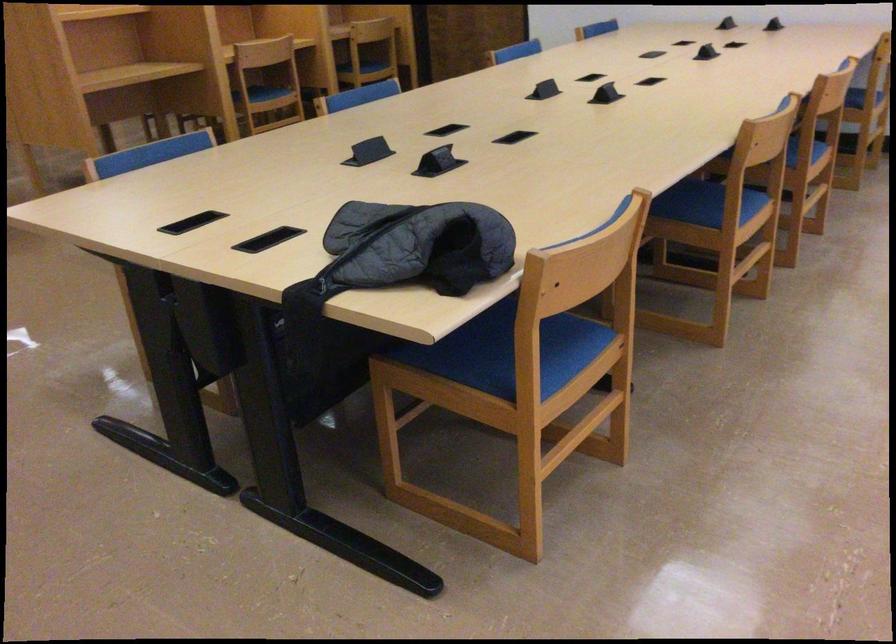
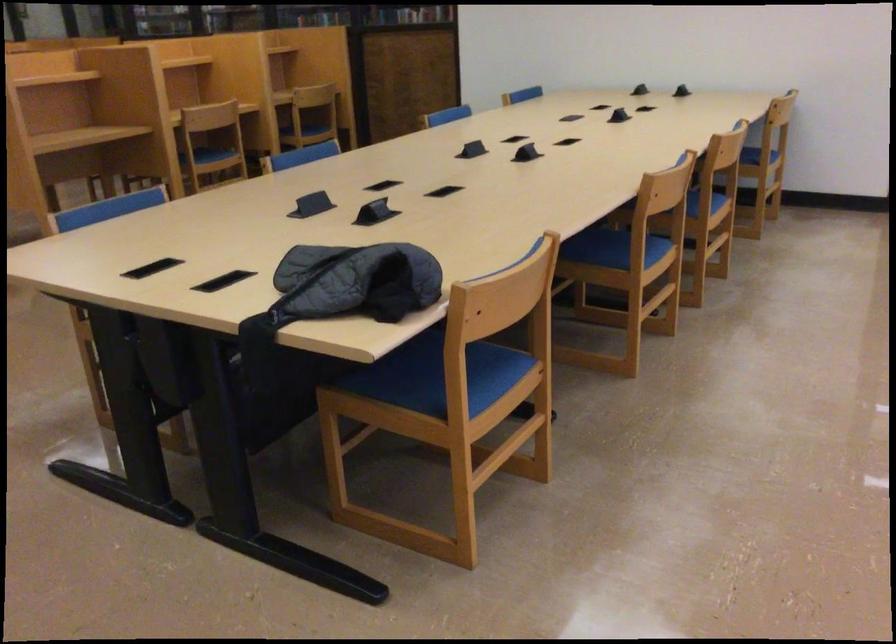
Find the pixel in the second image that matches the point at 719,210 in the first image.

(624, 254)